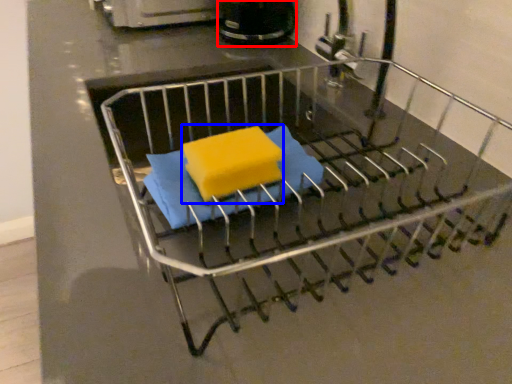
Question: Which point is closer to the camera, appliance (highlighted by a red box) or cheese (highlighted by a blue box)?

Choices:
 (A) appliance
 (B) cheese

Answer: (B)